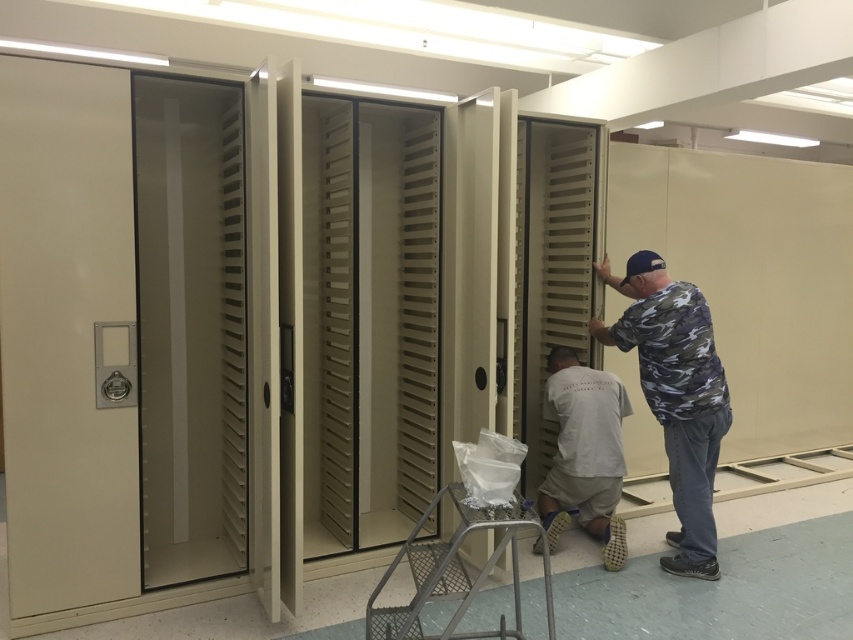
Between camo shirt at right and white cotton shirt at center, which one has more height?

camo shirt at right is taller.

Locate an element on the screen. The image size is (853, 640). camo shirt at right is located at coordinates (675, 394).

Which is behind, point (698, 301) or point (543, 410)?

Positioned behind is point (543, 410).

You are a GUI agent. You are given a task and a screenshot of the screen. Output one action in this format:
    pyautogui.click(x=<x>, y=<y>)
    Task: Click on the camo shirt at right
    This screenshot has width=853, height=640.
    Given the screenshot: What is the action you would take?
    pyautogui.click(x=675, y=394)

Is matte beige cabinet at center closer to the viewer compared to white cotton shirt at center?

Yes, it is.

Does matte beige cabinet at center have a greater height compared to white cotton shirt at center?

Indeed, matte beige cabinet at center has a greater height compared to white cotton shirt at center.

Looking at this image, measure the distance between matte beige cabinet at center and camera.

matte beige cabinet at center and camera are 3.33 meters apart from each other.

The height and width of the screenshot is (640, 853). Find the location of `matte beige cabinet at center`. matte beige cabinet at center is located at coordinates (369, 321).

Is matte beige cabinet at center to the left of camo shirt at right from the viewer's perspective?

Correct, you'll find matte beige cabinet at center to the left of camo shirt at right.

Does matte beige cabinet at center appear over camo shirt at right?

Yes.

What do you see at coordinates (369, 321) in the screenshot? This screenshot has height=640, width=853. I see `matte beige cabinet at center` at bounding box center [369, 321].

What are the coordinates of `matte beige cabinet at center` in the screenshot? It's located at (369, 321).